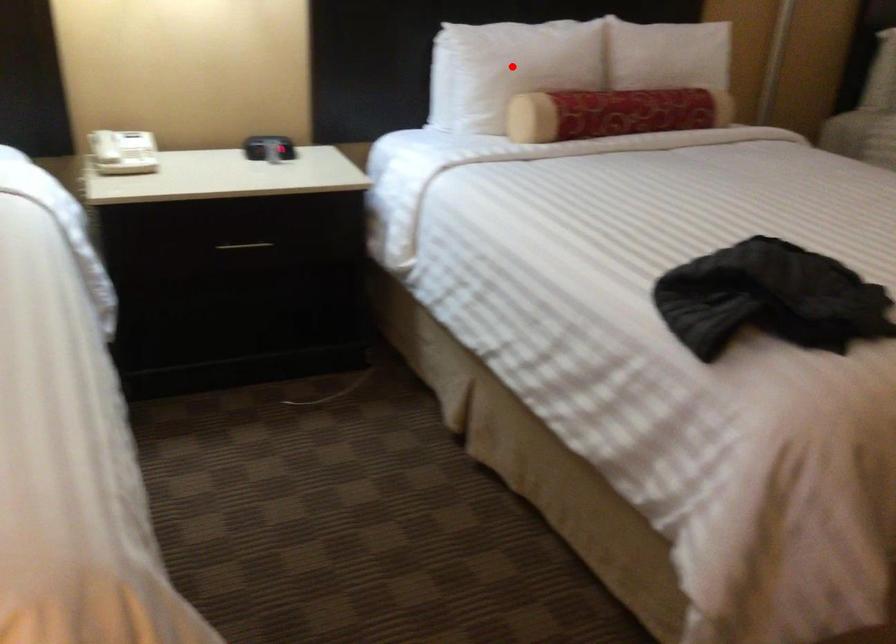
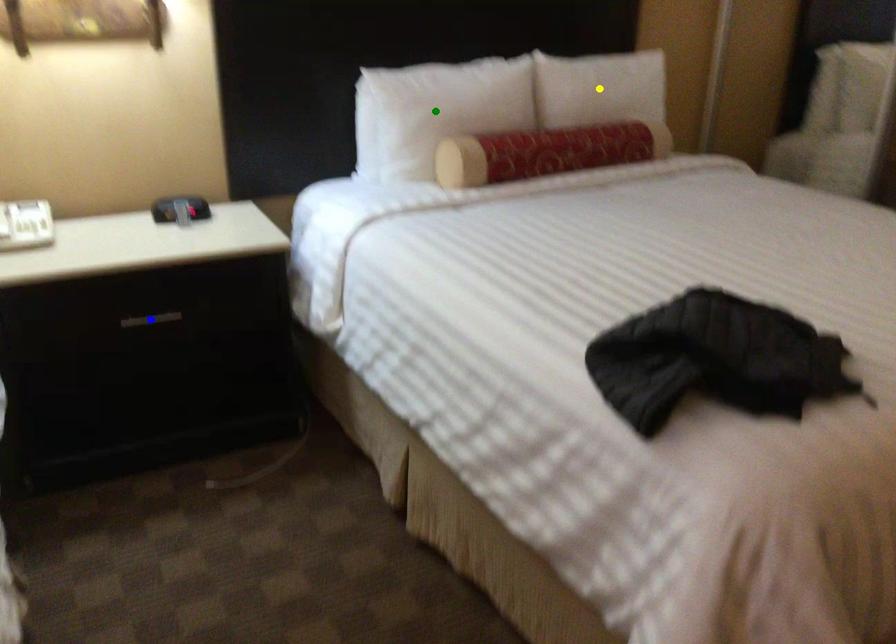
Question: I am providing you with two images of the same scene from different viewpoints. A red point is marked on the first image. You are given multiple points on the second image. Which spot in image 2 lines up with the point in image 1?

Choices:
 (A) blue point
 (B) green point
 (C) yellow point

Answer: (B)